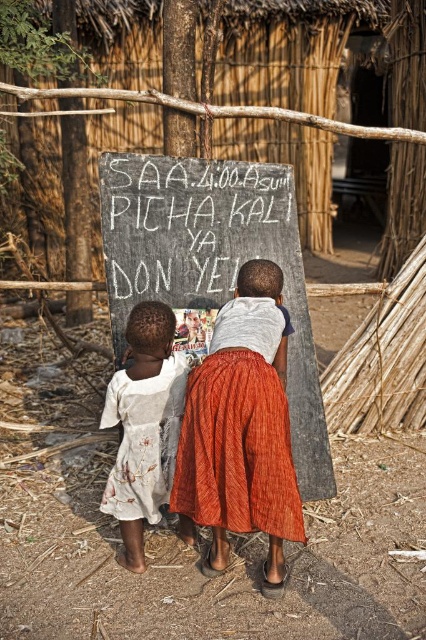
Who is positioned more to the left, orange textured skirt at center or white chalkboard at center?

white chalkboard at center is more to the left.

The width and height of the screenshot is (426, 640). What do you see at coordinates (241, 428) in the screenshot?
I see `orange textured skirt at center` at bounding box center [241, 428].

Does point (184, 440) lie behind point (109, 269)?

No, it is not.

Image resolution: width=426 pixels, height=640 pixels. Identify the location of orange textured skirt at center. (241, 428).

Does orange textured skirt at center have a lesser height compared to white printed dress at lower left?

No.

Does orange textured skirt at center appear on the right side of white printed dress at lower left?

Indeed, orange textured skirt at center is positioned on the right side of white printed dress at lower left.

Who is more forward, (258, 269) or (146, 496)?

Positioned in front is point (146, 496).

Identify the location of orange textured skirt at center. (241, 428).

Consider the image. Can you confirm if black chalkboard at center is taller than white chalkboard at center?

Yes, black chalkboard at center is taller than white chalkboard at center.

What do you see at coordinates (213, 262) in the screenshot? I see `black chalkboard at center` at bounding box center [213, 262].

Between point (249, 221) and point (189, 241), which one is positioned behind?

The point (249, 221) is more distant.

In order to click on black chalkboard at center in this screenshot , I will do `click(213, 262)`.